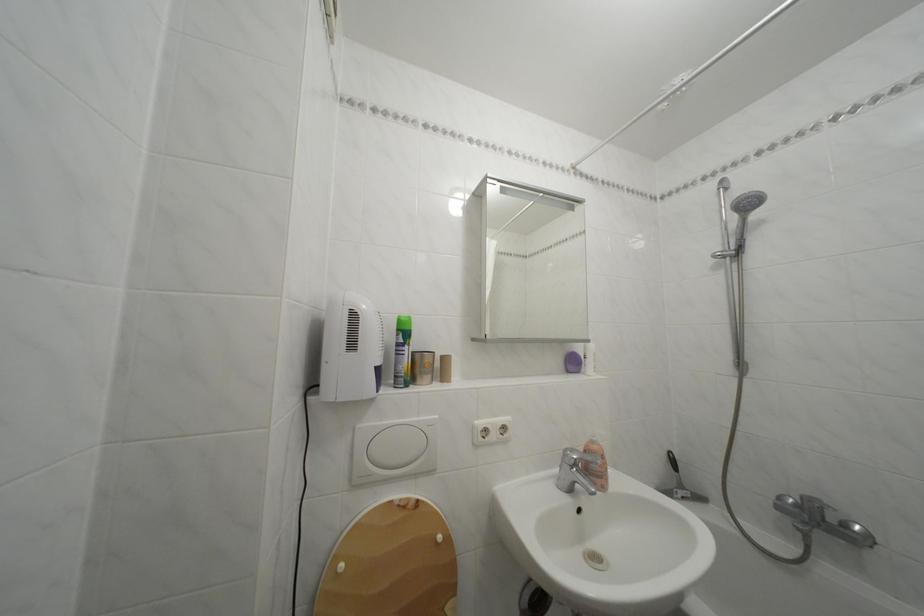
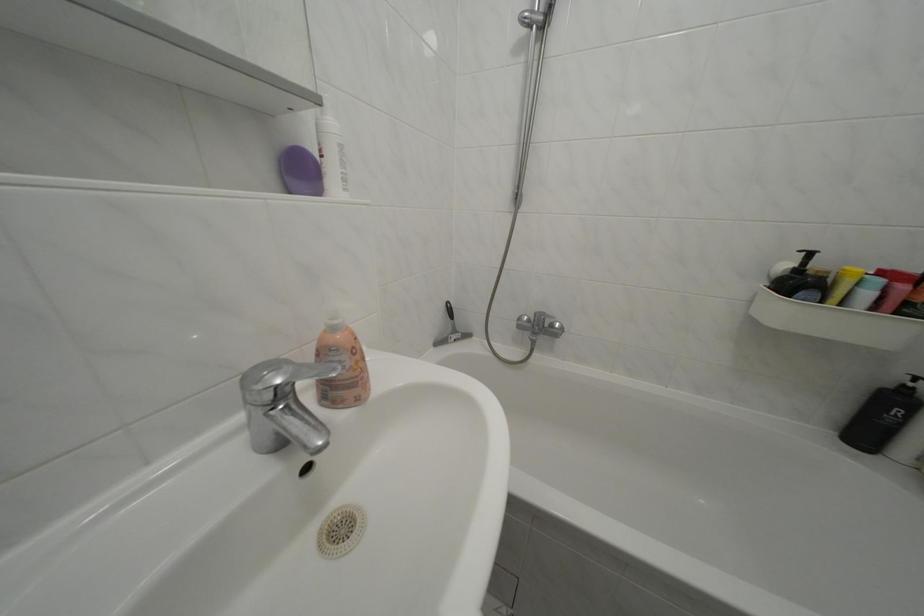
In the second image, find the point that corresponds to (579,357) in the first image.

(301, 150)